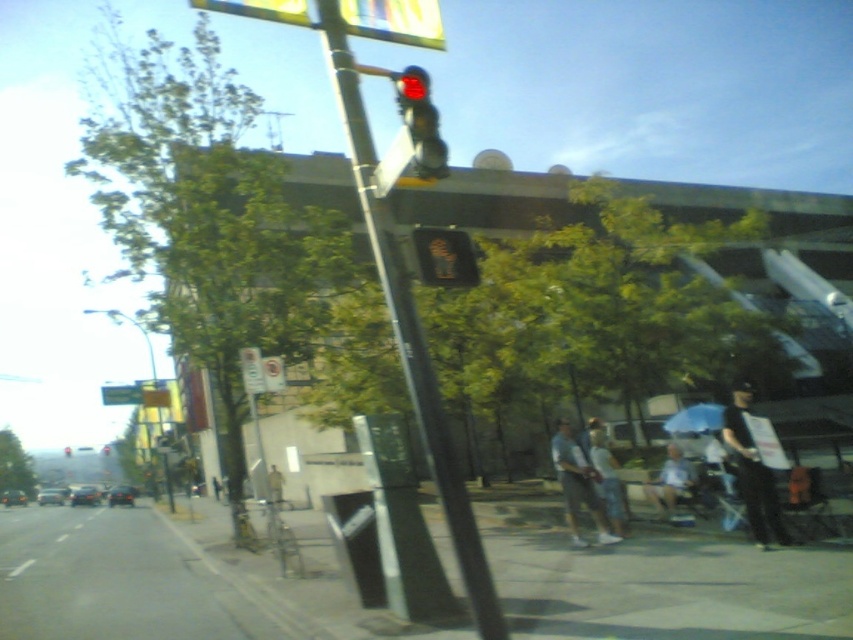
Question: Which object is positioned closest to the light blue jeans at center?

Choices:
 (A) gray concrete sidewalk at lower center
 (B) yellow fabric person at center
 (C) yellow plastic sign at upper center

Answer: (A)

Question: Can you confirm if black fabric shirt at center is positioned to the left of light blue jeans at center?

Choices:
 (A) yes
 (B) no

Answer: (B)

Question: Which point appears closest to the camera in this image?

Choices:
 (A) (426, 632)
 (B) (273, 472)
 (C) (679, 488)

Answer: (A)

Question: Is metallic pole at center thinner than red glass traffic light at upper center?

Choices:
 (A) yes
 (B) no

Answer: (A)

Question: Which of the following is the farthest from the observer?

Choices:
 (A) (51, 634)
 (B) (68, 454)
 (C) (428, 236)
 (D) (434, 132)

Answer: (B)

Question: In this image, where is yellow fabric person at center located relative to red glass traffic light at center?

Choices:
 (A) right
 (B) left

Answer: (A)